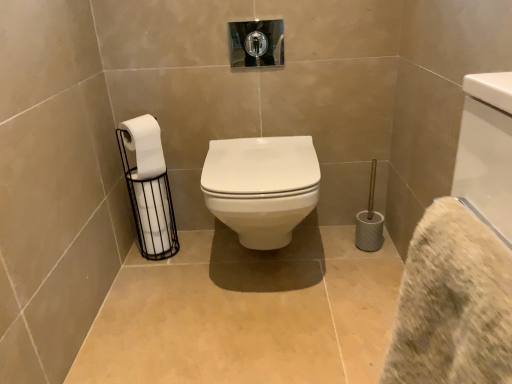
Question: Is white matte toilet paper at left, which is the 1th toilet paper from bottom to top, further to camera compared to white glossy toilet at center?

Choices:
 (A) no
 (B) yes

Answer: (B)

Question: Is there a large distance between white matte toilet paper at left, which is the 1th toilet paper from bottom to top, and white glossy toilet at center?

Choices:
 (A) no
 (B) yes

Answer: (A)

Question: From a real-world perspective, is white matte toilet paper at left, which is the 2th toilet paper in top-to-bottom order, positioned under white glossy toilet at center based on gravity?

Choices:
 (A) yes
 (B) no

Answer: (A)

Question: Is white matte toilet paper at left, which is the 2th toilet paper in top-to-bottom order, facing towards white glossy toilet at center?

Choices:
 (A) no
 (B) yes

Answer: (B)

Question: From the image's perspective, does white matte toilet paper at left, which is the 2th toilet paper in top-to-bottom order, appear lower than white glossy toilet at center?

Choices:
 (A) yes
 (B) no

Answer: (A)

Question: Does white matte toilet paper at left, which is the 1th toilet paper from bottom to top, have a lesser height compared to white glossy toilet at center?

Choices:
 (A) yes
 (B) no

Answer: (B)

Question: Does white matte toilet paper at left, which is the 1th toilet paper from bottom to top, have a greater width compared to beige textured bath towel at lower right?

Choices:
 (A) no
 (B) yes

Answer: (B)

Question: Is white matte toilet paper at left, which is the 1th toilet paper from bottom to top, further to camera compared to beige textured bath towel at lower right?

Choices:
 (A) no
 (B) yes

Answer: (B)

Question: From a real-world perspective, is white matte toilet paper at left, which is the 1th toilet paper from bottom to top, physically below beige textured bath towel at lower right?

Choices:
 (A) no
 (B) yes

Answer: (B)

Question: Is there a large distance between white matte toilet paper at left, which is the 2th toilet paper in top-to-bottom order, and beige textured bath towel at lower right?

Choices:
 (A) no
 (B) yes

Answer: (B)

Question: Is white matte toilet paper at left, which is the 2th toilet paper in top-to-bottom order, shorter than beige textured bath towel at lower right?

Choices:
 (A) no
 (B) yes

Answer: (A)

Question: Is white matte toilet paper at left, which is the 2th toilet paper in top-to-bottom order, thinner than beige textured bath towel at lower right?

Choices:
 (A) no
 (B) yes

Answer: (A)

Question: Can you confirm if white matte toilet paper at left, which is the 1th toilet paper from bottom to top, is shorter than white matte toilet paper at left, which is the 1th toilet paper in top-to-bottom order?

Choices:
 (A) no
 (B) yes

Answer: (A)